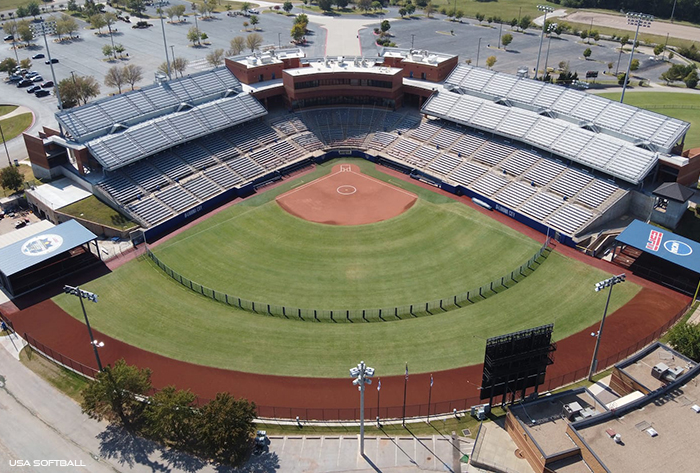
Find the location of a particular element. shade is located at coordinates (332, 110), (367, 111).